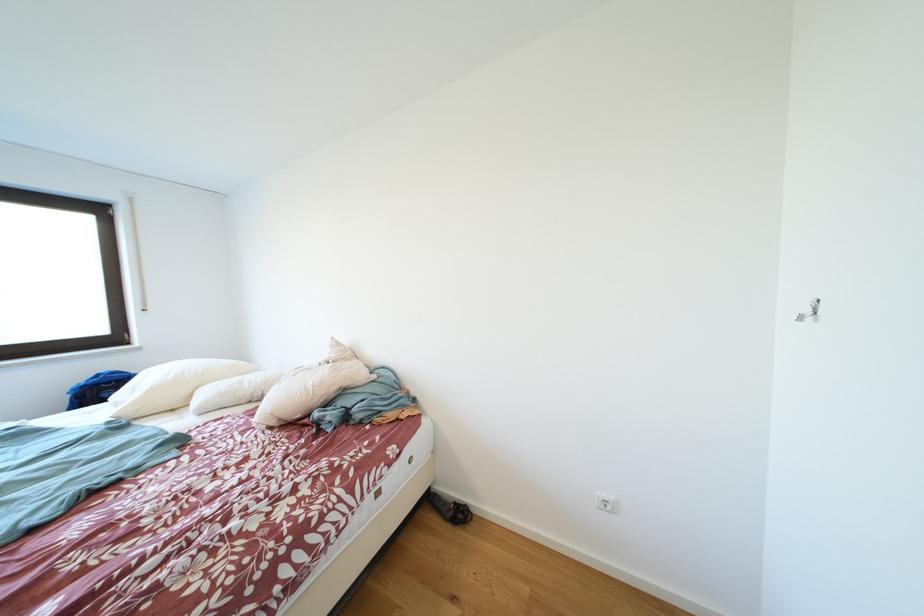
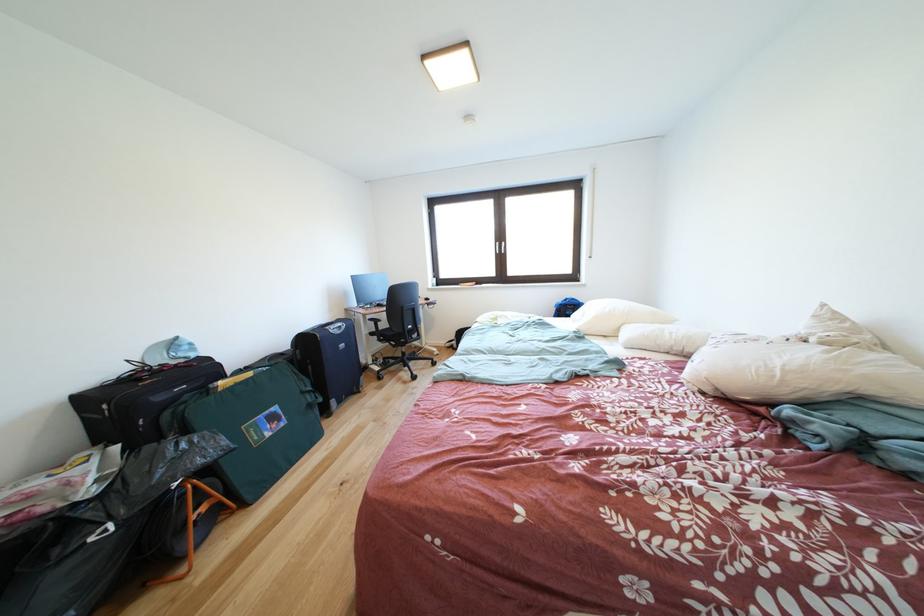
Question: I am providing you with two images of the same scene from different viewpoints. Please identify which objects are invisible in image2.

Choices:
 (A) long white pillow
 (B) black suitcase handle
 (C) black chair sitting surface
 (D) none of these

Answer: (D)